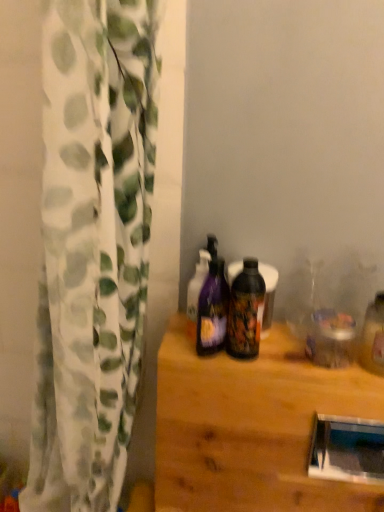
Question: Is glossy plastic bottle at center, the first bottle in the right-to-left sequence, wider or thinner than purple glossy bottle at center, the 2th bottle when ordered from right to left?

Choices:
 (A) wide
 (B) thin

Answer: (B)

Question: From the image's perspective, is glossy plastic bottle at center, which is the 2th bottle in left-to-right order, above or below purple glossy bottle at center, the 2th bottle when ordered from right to left?

Choices:
 (A) above
 (B) below

Answer: (A)

Question: Which of these objects is positioned closest to the white textured curtain at left?

Choices:
 (A) wooden table at center
 (B) glossy plastic bottle at center, which is the 2th bottle in left-to-right order
 (C) purple glossy bottle at center, the first bottle from the left

Answer: (A)

Question: Which object is the closest to the glossy plastic bottle at center, the first bottle in the right-to-left sequence?

Choices:
 (A) wooden table at center
 (B) purple glossy bottle at center, the first bottle from the left
 (C) white textured curtain at left

Answer: (B)